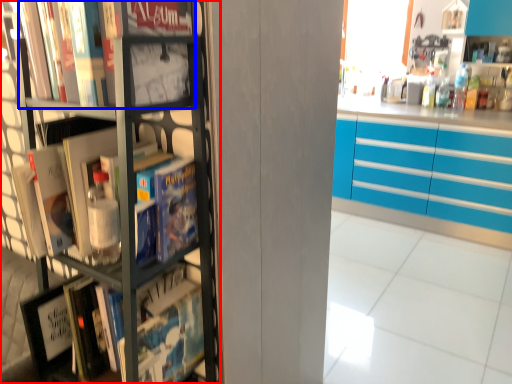
Question: Which object is closer to the camera taking this photo, bookcase (highlighted by a red box) or book (highlighted by a blue box)?

Choices:
 (A) bookcase
 (B) book

Answer: (A)